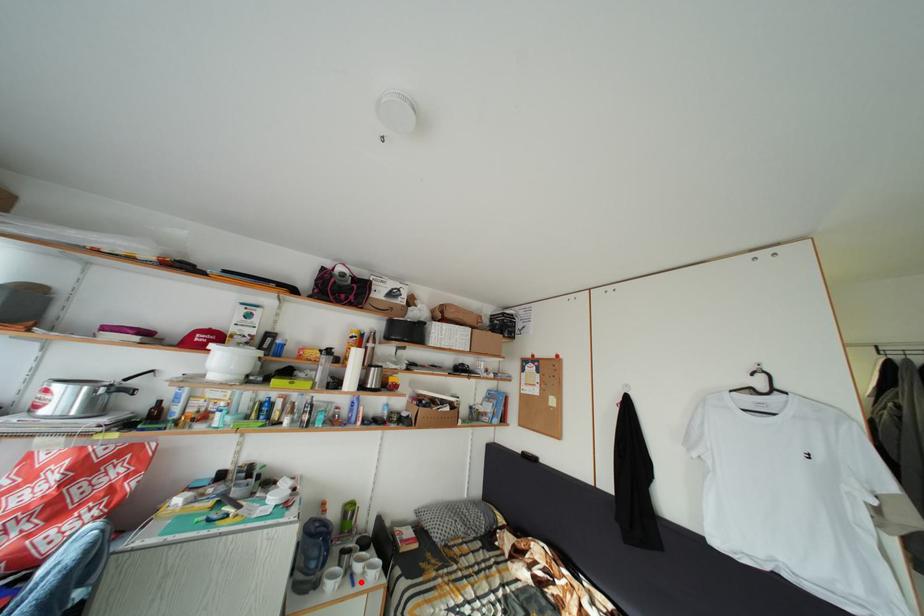
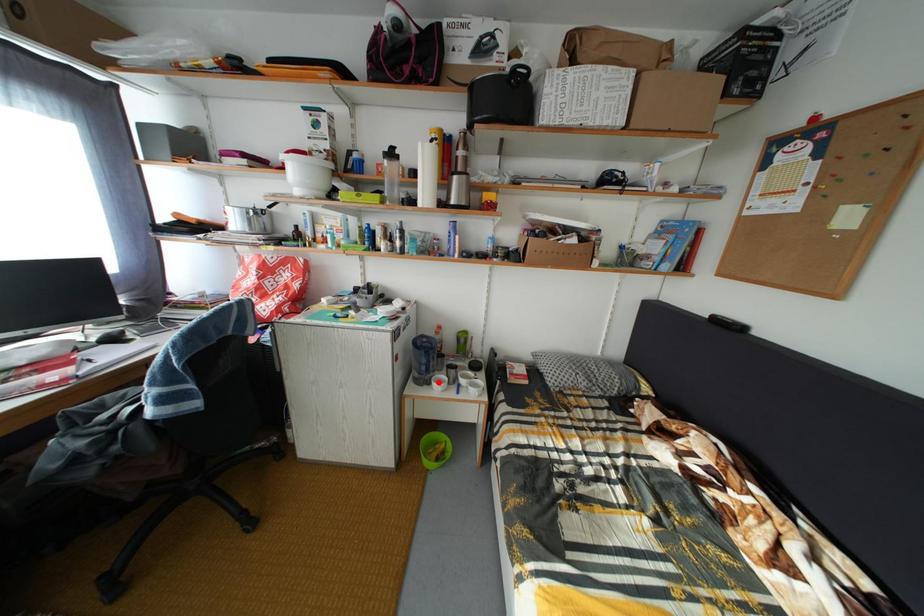
I am providing you with two images of the same scene from different viewpoints. A red point is marked on the first image and another point is marked on the second image. Is the red point in image1 aligned with the point shown in image2?

No